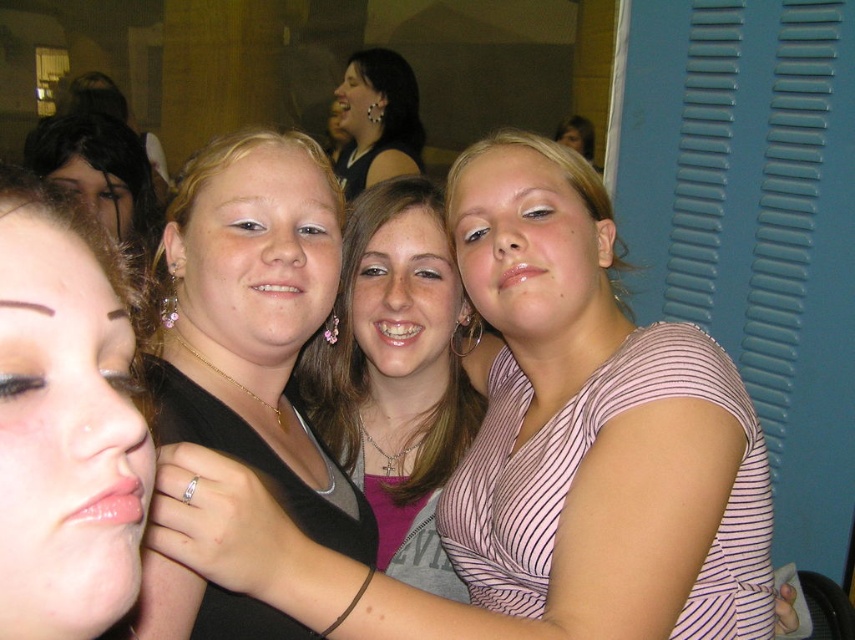
You are a photographer trying to capture a closeup of the matte black hair at left and the matte black top at upper center. Which object is positioned closer to the camera?

The matte black hair at left is closer to the viewer than the matte black top at upper center, so the matte black hair at left will appear closer in the photo.